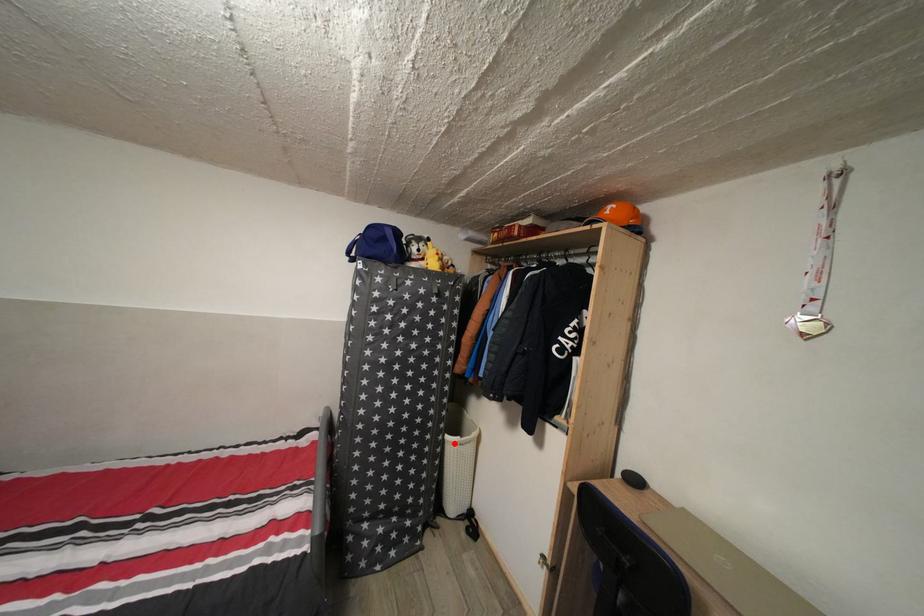
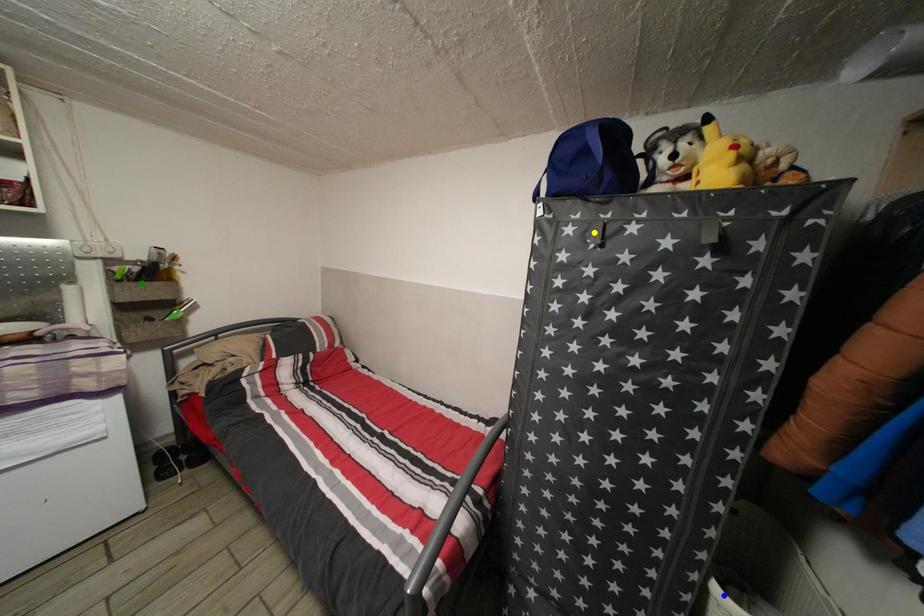
Question: I am providing you with two images of the same scene from different viewpoints. A red point is marked on the first image. You are given multiple points on the second image. Which point in image 2 is actually the same real-world point as the red point in image 1?

Choices:
 (A) blue point
 (B) green point
 (C) yellow point

Answer: (A)